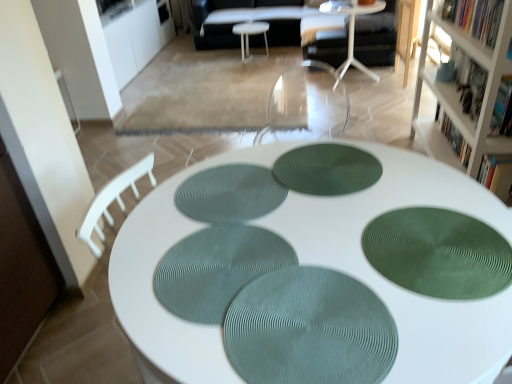
This screenshot has width=512, height=384. Find the location of `free space between teal textured placemat at center, the third mat viewed from the right, and green textured mat at lower right, acting as the fourth mat starting from the left`. free space between teal textured placemat at center, the third mat viewed from the right, and green textured mat at lower right, acting as the fourth mat starting from the left is located at coordinates (x=330, y=274).